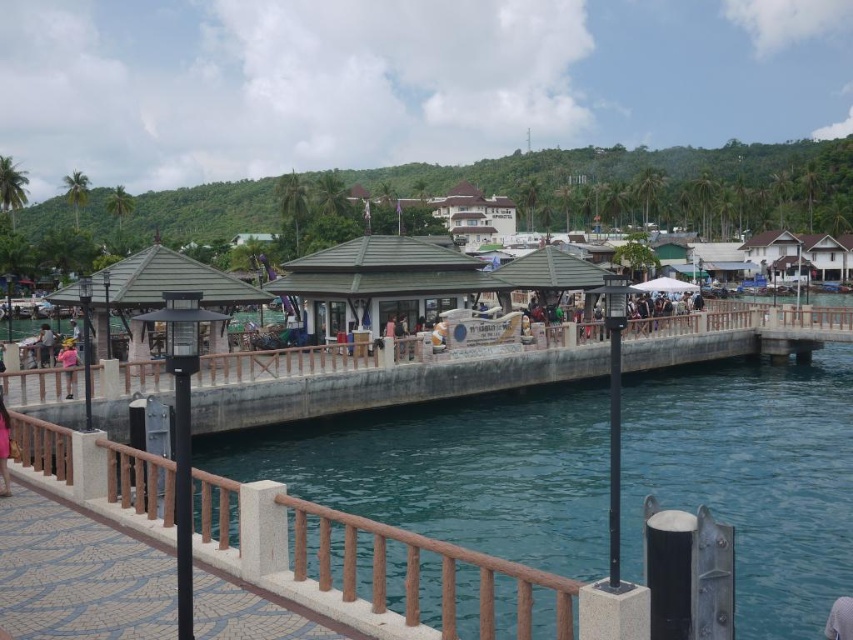
Measure the distance between teal water at center and pink fabric at lower left.

A distance of 26.91 meters exists between teal water at center and pink fabric at lower left.

Does teal water at center have a smaller size compared to pink fabric at lower left?

No.

What do you see at coordinates (453, 470) in the screenshot? I see `teal water at center` at bounding box center [453, 470].

The width and height of the screenshot is (853, 640). I want to click on teal water at center, so click(453, 470).

Does brown polished wood rail at lower center appear over pink fabric at center?

Incorrect, brown polished wood rail at lower center is not positioned above pink fabric at center.

Is brown polished wood rail at lower center wider than pink fabric at center?

Indeed, brown polished wood rail at lower center has a greater width compared to pink fabric at center.

Identify the location of brown polished wood rail at lower center. (416, 573).

Can you confirm if green matte gazebo at center is bigger than matte black jacket at center?

Actually, green matte gazebo at center might be smaller than matte black jacket at center.

Can you confirm if green matte gazebo at center is positioned to the left of matte black jacket at center?

Yes, green matte gazebo at center is to the left of matte black jacket at center.

Image resolution: width=853 pixels, height=640 pixels. What do you see at coordinates (379, 284) in the screenshot?
I see `green matte gazebo at center` at bounding box center [379, 284].

Identify the location of green matte gazebo at center. (379, 284).